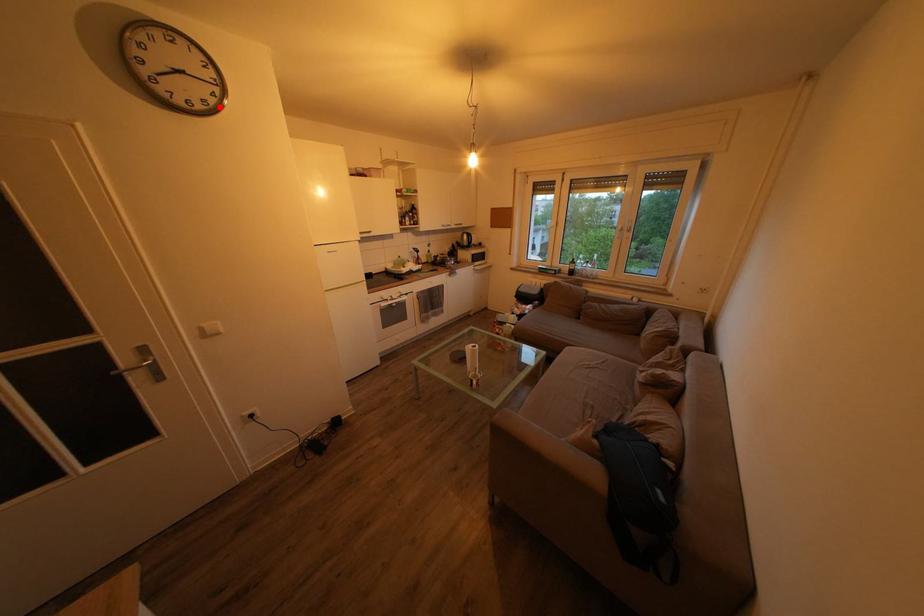
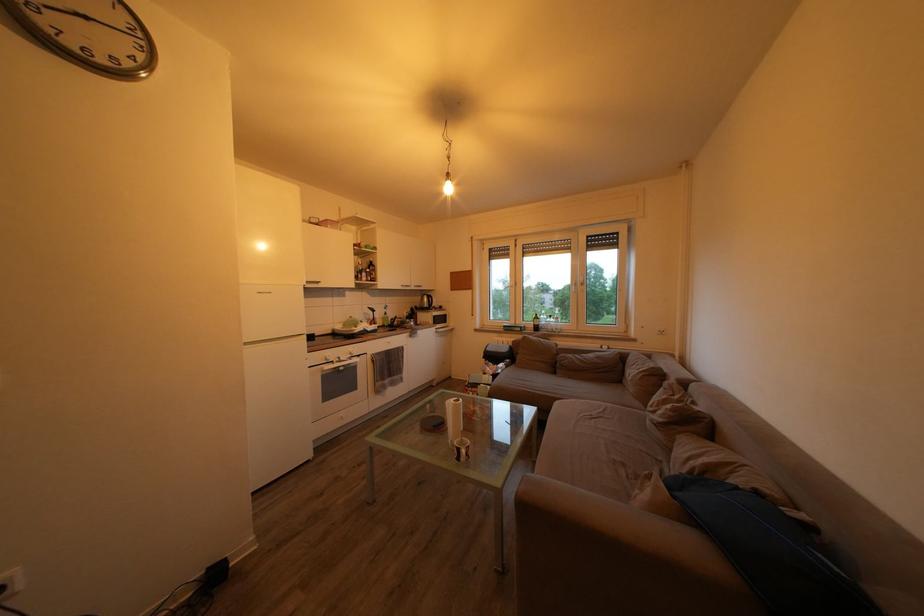
Locate, in the second image, the point that corresponds to the highlighted location in the first image.

(134, 69)